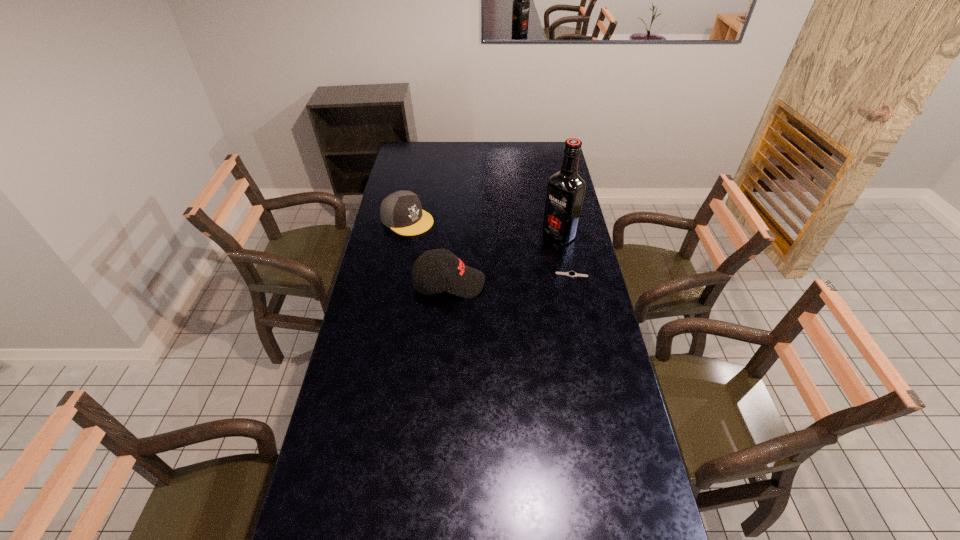
The width and height of the screenshot is (960, 540). What are the coordinates of `free spot at the near right corner of the desktop` in the screenshot? It's located at (603, 512).

Identify the location of free spot between the third tallest object and the tallest object. (483, 227).

The image size is (960, 540). I want to click on free space between the watch and the third shortest object, so click(x=511, y=279).

At what (x,y) coordinates should I click in order to perform the action: click on unoccupied area between the cap and the shortest object. Please return your answer as a coordinate pair (x, y). The width and height of the screenshot is (960, 540). Looking at the image, I should click on (490, 247).

This screenshot has width=960, height=540. Find the location of `free space between the second tallest object and the shortest object`. free space between the second tallest object and the shortest object is located at coordinates (511, 279).

I want to click on free space between the second shortest object and the liquor, so click(483, 227).

I want to click on free spot between the second tallest object and the tallest object, so click(x=504, y=259).

The image size is (960, 540). I want to click on vacant space that is in between the shortest object and the cap, so click(x=490, y=247).

This screenshot has width=960, height=540. In order to click on free point between the watch and the tallest object in this screenshot , I will do `click(565, 255)`.

Where is `vacant point located between the second shortest object and the watch`? This screenshot has height=540, width=960. vacant point located between the second shortest object and the watch is located at coordinates (490, 247).